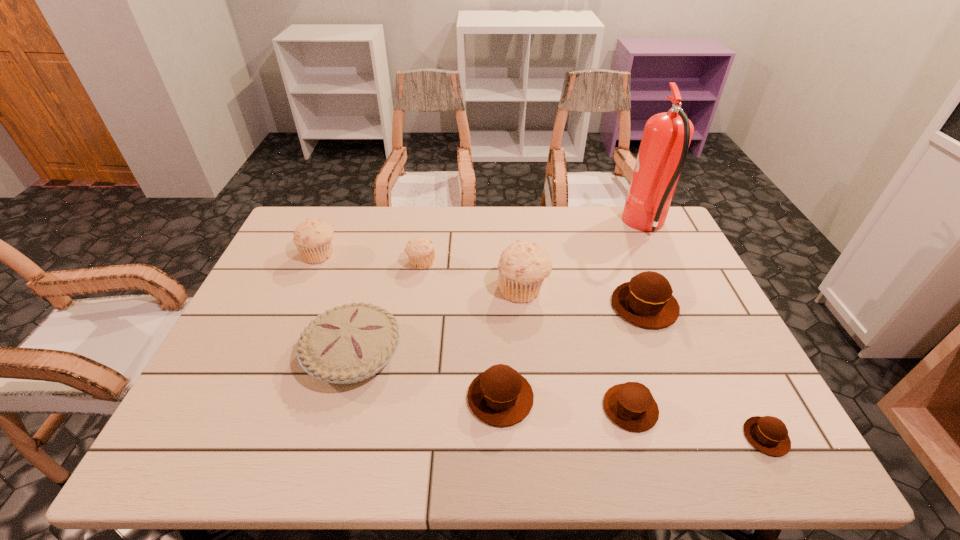
This screenshot has width=960, height=540. Identify the location of free area in between the second smallest brown muffin and the second beige muffin from right to left. (526, 335).

This screenshot has width=960, height=540. Find the location of `free space between the rightmost brown muffin and the sixth tallest muffin`. free space between the rightmost brown muffin and the sixth tallest muffin is located at coordinates (698, 423).

Locate an element on the screen. The image size is (960, 540). vacant space in between the biggest brown muffin and the second biggest brown muffin is located at coordinates (572, 352).

Where is `free point between the pie and the leftmost brown muffin`? free point between the pie and the leftmost brown muffin is located at coordinates (427, 376).

Where is `free area in between the smallest beige muffin and the biggest beige muffin`? The width and height of the screenshot is (960, 540). free area in between the smallest beige muffin and the biggest beige muffin is located at coordinates (472, 276).

The width and height of the screenshot is (960, 540). What are the coordinates of `free area in between the second muffin from left to right and the leftmost muffin` in the screenshot? It's located at (371, 259).

Locate an element on the screen. vacant space that is in between the leftmost brown muffin and the smallest beige muffin is located at coordinates (461, 330).

Locate an element on the screen. object that ranks as the fourth closest to the leftmost brown muffin is located at coordinates (646, 301).

Identify the location of object identified as the fifth closest to the eighth tallest object. The image size is (960, 540). (350, 343).

Point out which muffin is positioned as the fourth nearest to the smallest brown muffin. Please provide its 2D coordinates. Your answer should be formatted as a tuple, i.e. [(x, y)], where the tuple contains the x and y coordinates of a point satisfying the conditions above.

[(522, 267)]